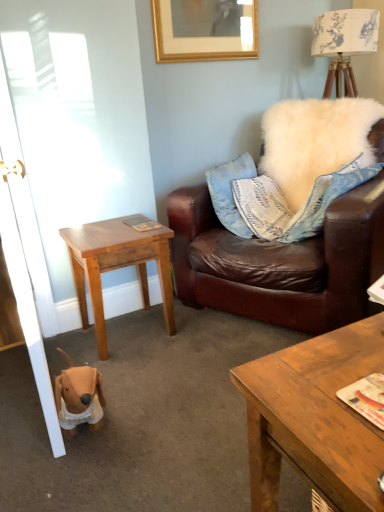
The width and height of the screenshot is (384, 512). In order to click on vacant area on top of light brown wooden table at lower left (from a real-world perspective) in this screenshot , I will do `click(115, 228)`.